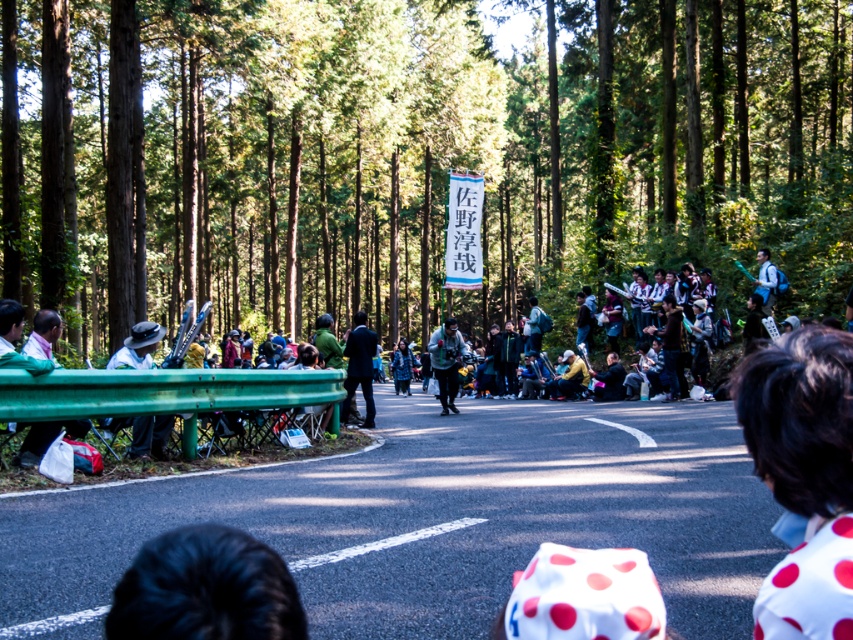
Question: Which of the following is the farthest from the observer?

Choices:
 (A) (672, 177)
 (B) (151, 326)
 (C) (109, 616)
 (D) (433, 372)

Answer: (A)

Question: Can you confirm if green wood trees at center is bigger than white polka dot fabric at center?

Choices:
 (A) yes
 (B) no

Answer: (A)

Question: Which object appears closest to the camera in this image?

Choices:
 (A) white polka dot fabric at center
 (B) green wood trees at center
 (C) white matte hat at left

Answer: (A)

Question: Is white dotted shirt at lower right closer to camera compared to matte black camera at center?

Choices:
 (A) no
 (B) yes

Answer: (B)

Question: Among these objects, which one is farthest from the camera?

Choices:
 (A) green wood trees at center
 (B) white matte hat at left

Answer: (A)

Question: Does green wood trees at center appear on the right side of matte black camera at center?

Choices:
 (A) no
 (B) yes

Answer: (A)